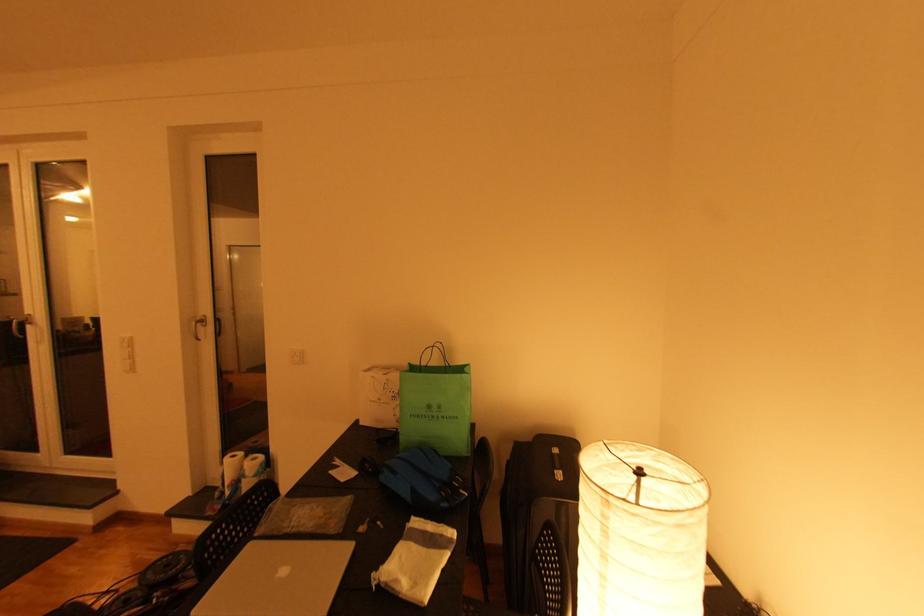
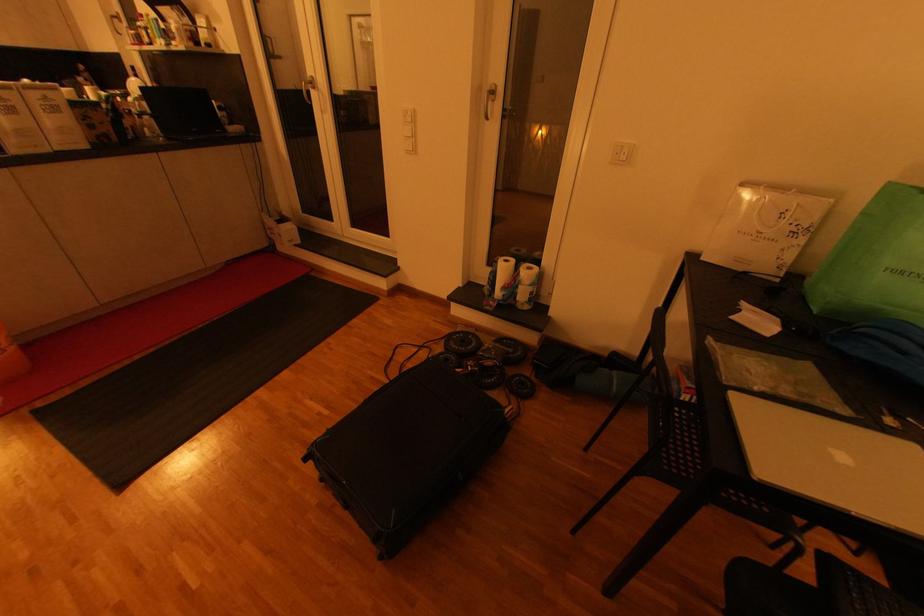
In the second image, find the point that corresponds to [259,459] in the first image.

(533, 269)